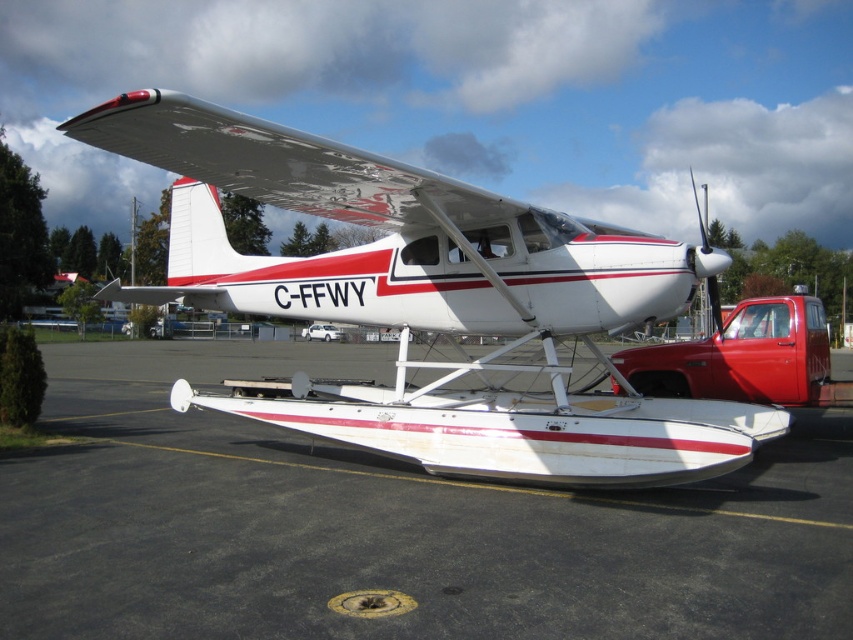
Question: Which point appears farthest from the camera in this image?

Choices:
 (A) (466, 202)
 (B) (311, 330)
 (C) (115, 545)
 (D) (780, 308)

Answer: (B)

Question: Among these points, which one is nearest to the camera?

Choices:
 (A) (318, 323)
 (B) (817, 376)
 (C) (630, 266)
 (D) (44, 547)

Answer: (D)

Question: Can you confirm if white matte seaplane at center is thinner than white matte car at center?

Choices:
 (A) no
 (B) yes

Answer: (A)

Question: Does white matte seaplane at center have a smaller size compared to metallic red pickup truck at center right?

Choices:
 (A) no
 (B) yes

Answer: (A)

Question: Which point is farther to the camera?

Choices:
 (A) white matte seaplane at center
 (B) white matte car at center
 (C) white asphalt tarmac at center
 (D) metallic red pickup truck at center right

Answer: (D)

Question: Does white asphalt tarmac at center appear over white matte seaplane at center?

Choices:
 (A) no
 (B) yes

Answer: (A)